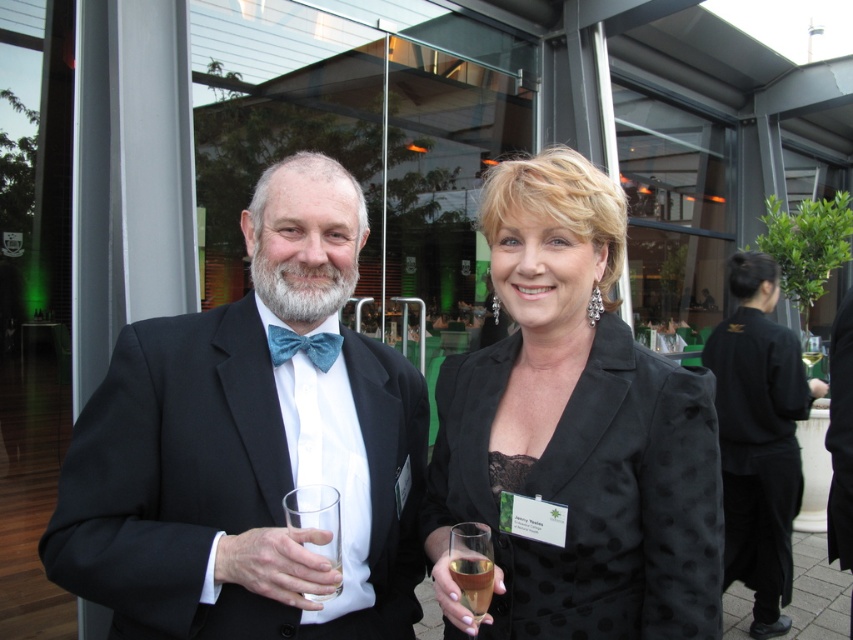
Question: Does matte black suit at center appear under clear glass at center?

Choices:
 (A) no
 (B) yes

Answer: (A)

Question: Is matte black suit at center positioned in front of translucent glass at lower center?

Choices:
 (A) yes
 (B) no

Answer: (A)

Question: Which object appears closest to the camera in this image?

Choices:
 (A) matte black suit at center
 (B) translucent glass at lower center

Answer: (A)

Question: Among these objects, which one is farthest from the camera?

Choices:
 (A) matte black suit at center
 (B) black dotted blazer at center

Answer: (B)

Question: Which point is farther to the camera?

Choices:
 (A) black satin suit at center
 (B) black satin business suit at right
 (C) clear glass at center

Answer: (B)

Question: Can you confirm if black satin suit at center is smaller than clear glass at center?

Choices:
 (A) yes
 (B) no

Answer: (B)